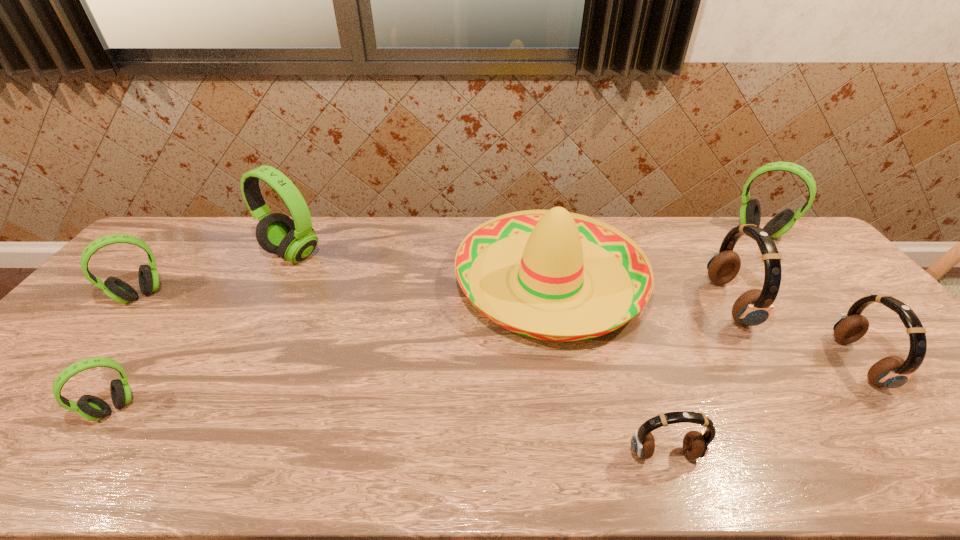
Locate which brown headset is the second closest to the red sombrero. Please provide its 2D coordinates. Your answer should be formatted as a tuple, i.e. [(x, y)], where the tuple contains the x and y coordinates of a point satisfying the conditions above.

[(696, 444)]

What are the coordinates of `vacant space that satisfies the following two spatial constraints: 1. on the back side of the leftmost object; 2. on the left side of the third smallest green headset` in the screenshot? It's located at (194, 232).

The image size is (960, 540). Identify the location of free space that satisfies the following two spatial constraints: 1. on the ear cup of the rightmost brown headset; 2. on the ear cup of the nearest brown headset. (931, 454).